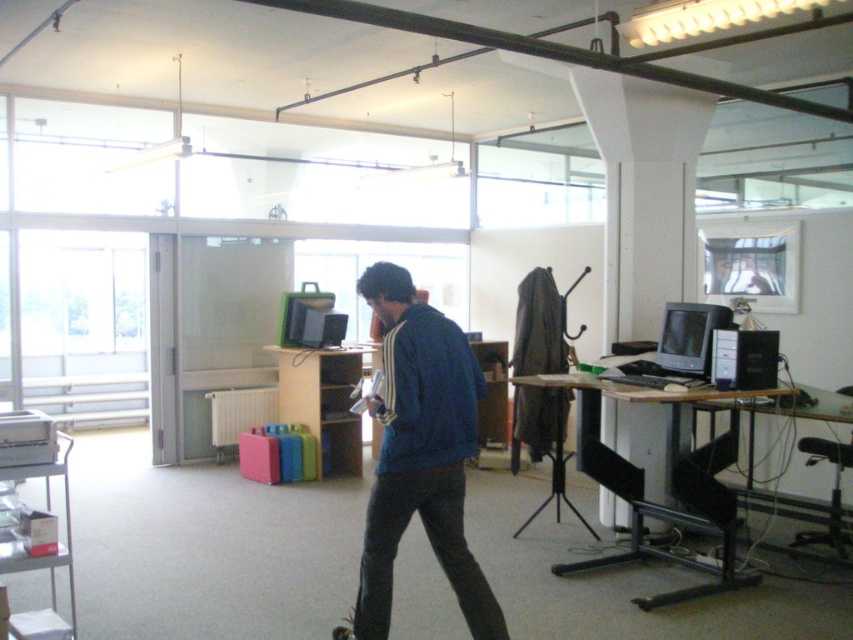
You are an office cleaner who needs to move the metallic silver skateboard at lower center to the storage room. However, you must avoid bumping into the blue fabric jacket at center. Based on their positions, which direction should you move the skateboard to avoid the jacket?

The blue fabric jacket at center is to the right of the metallic silver skateboard at lower center. To avoid the jacket, move the skateboard to the left direction away from the jacket.

You are a delivery person entering the office and need to place a small package between the blue fabric jacket at center and the metallic silver skateboard at lower center. Is there enough space to fit the package?

The blue fabric jacket at center and metallic silver skateboard at lower center are 26.96 inches apart, so there is sufficient space to place a small package between them.